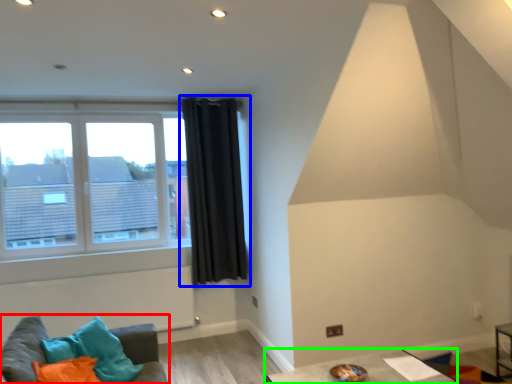
Question: Based on their relative distances, which object is farther from studio couch (highlighted by a red box)? Choose from curtain (highlighted by a blue box) and table (highlighted by a green box).

Choices:
 (A) curtain
 (B) table

Answer: (A)